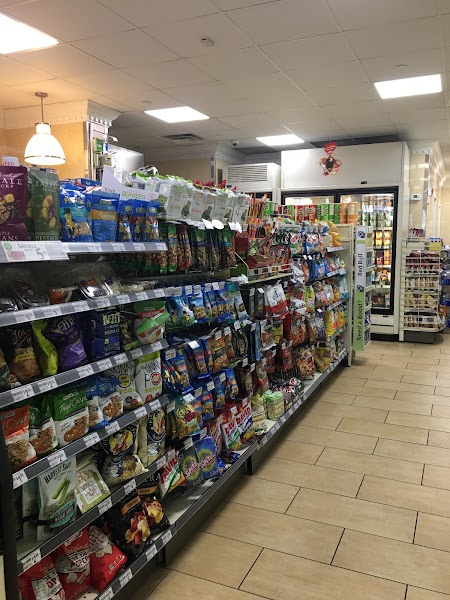
This screenshot has height=600, width=450. I want to click on decoration, so click(329, 167).